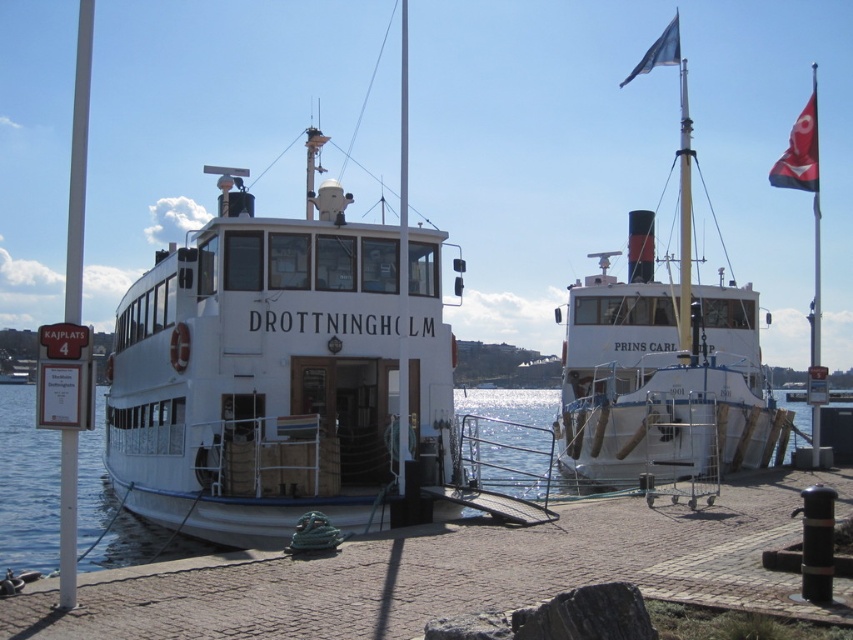
Question: From the image, what is the correct spatial relationship of clear water at center in relation to white matte pole at left?

Choices:
 (A) left
 (B) right

Answer: (B)

Question: Does clear water at center appear under white matte pole at left?

Choices:
 (A) no
 (B) yes

Answer: (B)

Question: Which point is closer to the camera taking this photo?

Choices:
 (A) (317, 492)
 (B) (152, 529)
 (C) (730, 308)

Answer: (A)

Question: Which object is the closest to the clear water at center?

Choices:
 (A) white matte ship at right
 (B) white matte ferry at center

Answer: (B)

Question: Is the position of white matte ferry at center less distant than that of white matte ship at right?

Choices:
 (A) no
 (B) yes

Answer: (B)

Question: Among these objects, which one is farthest from the camera?

Choices:
 (A) clear water at center
 (B) white matte ship at right
 (C) white matte pole at left
 (D) white matte ferry at center

Answer: (B)